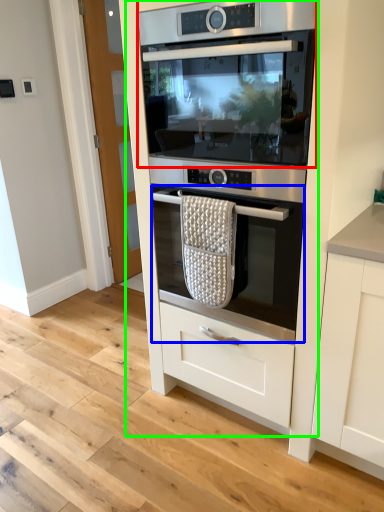
Question: Which object is the farthest from home appliance (highlighted by a red box)? Choose among these: oven (highlighted by a blue box) or oven (highlighted by a green box).

Choices:
 (A) oven
 (B) oven

Answer: (A)